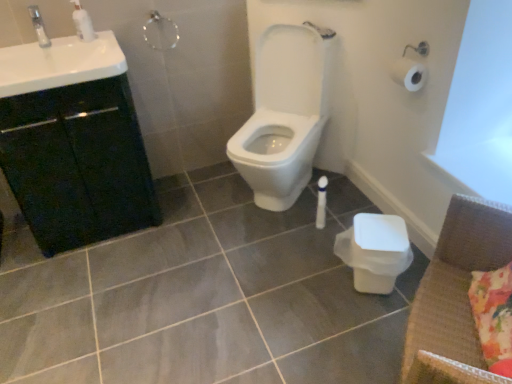
Question: Does white glossy soap dispenser at upper left appear on the left side of white glossy sink at upper left?

Choices:
 (A) no
 (B) yes

Answer: (A)

Question: Does white glossy soap dispenser at upper left have a larger size compared to white glossy sink at upper left?

Choices:
 (A) no
 (B) yes

Answer: (A)

Question: Is white glossy soap dispenser at upper left far away from white glossy sink at upper left?

Choices:
 (A) no
 (B) yes

Answer: (A)

Question: Does white glossy soap dispenser at upper left have a smaller size compared to white glossy sink at upper left?

Choices:
 (A) no
 (B) yes

Answer: (B)

Question: From the image's perspective, is white glossy soap dispenser at upper left above white glossy sink at upper left?

Choices:
 (A) no
 (B) yes

Answer: (B)

Question: Is point (352, 256) closer or farther from the camera than point (55, 74)?

Choices:
 (A) closer
 (B) farther

Answer: (B)

Question: Is white plastic toilet bowl at lower right situated inside white glossy sink at upper left or outside?

Choices:
 (A) inside
 (B) outside

Answer: (B)

Question: From a real-world perspective, is white plastic toilet bowl at lower right positioned above or below white glossy sink at upper left?

Choices:
 (A) above
 (B) below

Answer: (B)

Question: In terms of size, does white plastic toilet bowl at lower right appear bigger or smaller than white glossy sink at upper left?

Choices:
 (A) big
 (B) small

Answer: (B)

Question: From a real-world perspective, is white glossy toilet at center physically located above or below black matte cabinet at left?

Choices:
 (A) above
 (B) below

Answer: (A)

Question: From the image's perspective, is white glossy toilet at center located above or below black matte cabinet at left?

Choices:
 (A) above
 (B) below

Answer: (A)

Question: Considering the positions of white glossy toilet at center and black matte cabinet at left in the image, is white glossy toilet at center bigger or smaller than black matte cabinet at left?

Choices:
 (A) small
 (B) big

Answer: (A)

Question: Looking at their shapes, would you say white glossy toilet at center is wider or thinner than black matte cabinet at left?

Choices:
 (A) thin
 (B) wide

Answer: (B)

Question: Does point (30, 62) appear closer or farther from the camera than point (390, 256)?

Choices:
 (A) closer
 (B) farther

Answer: (B)

Question: Looking at their shapes, would you say white glossy sink at upper left is wider or thinner than white plastic toilet bowl at lower right?

Choices:
 (A) thin
 (B) wide

Answer: (B)